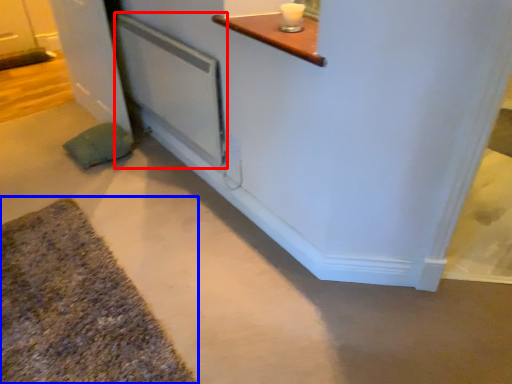
Question: Which object appears farthest to the camera in this image, screen door (highlighted by a red box) or bath mat (highlighted by a blue box)?

Choices:
 (A) screen door
 (B) bath mat

Answer: (A)